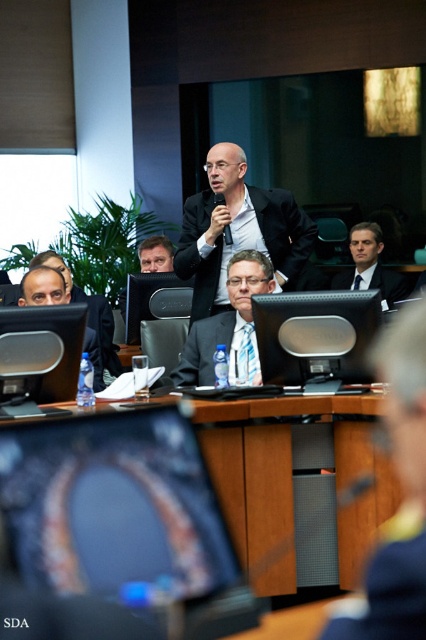
Looking at this image, you are organizing a presentation and need to place a 12 inch wide laptop between the matte black monitor at center and the satin blue suit at center. Can the laptop fit between them?

The matte black monitor at center is narrower than the satin blue suit at center. Since the laptop is 12 inches wide, it depends on the available space between them. However, the description only states the monitor is narrower, not the exact distance. Without specific measurements of the gap, we cannot confirm if the laptop will fit.

You are a photographer at a formal event. You need to capture a clear photo of the blue striped tie at center without including the satin blue suit at center in the frame. Is this possible based on their positions?

The satin blue suit at center is positioned over the blue striped tie at center, so it would block the view of the tie. Therefore, capturing a clear photo of the blue striped tie at center without including the satin blue suit at center is not possible.